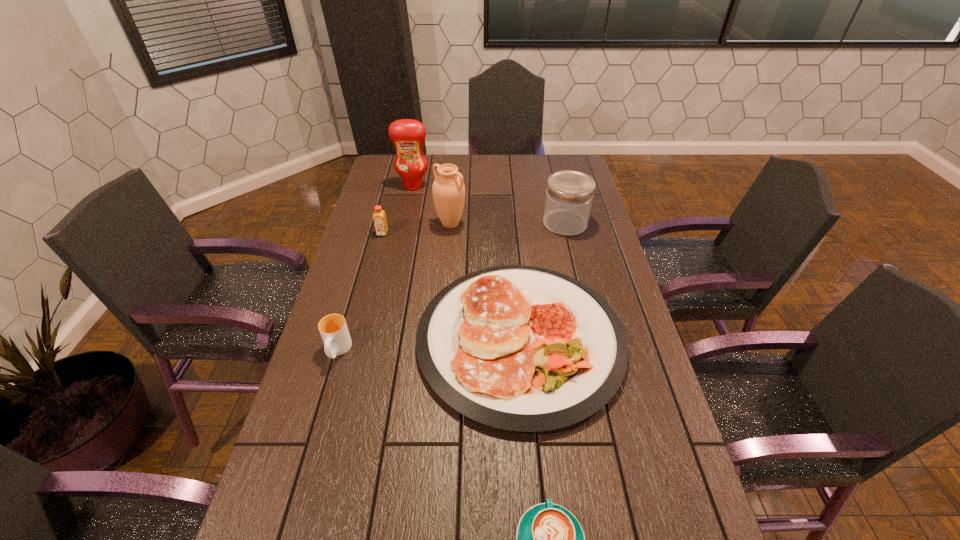
Find the location of a particular element. vacant space positioned 0.140m on the front and back of the orange juice is located at coordinates (374, 262).

This screenshot has height=540, width=960. I want to click on vacant space located with the handle on the side of the fifth tallest object, so click(283, 534).

Identify the location of vacant position located 0.200m on the front of the dish. (537, 531).

Identify the location of object at the far edge. The height and width of the screenshot is (540, 960). (408, 135).

I want to click on condiment at the left edge, so click(x=408, y=135).

This screenshot has height=540, width=960. I want to click on orange juice present at the left edge, so click(x=379, y=216).

Find the location of a particular element. cup that is at the left edge is located at coordinates (333, 328).

This screenshot has width=960, height=540. What are the coordinates of `jar at the right edge` in the screenshot? It's located at (569, 196).

I want to click on dish present at the right edge, so click(521, 348).

Find the location of a particular element. The height and width of the screenshot is (540, 960). object positioned at the far left corner is located at coordinates (408, 135).